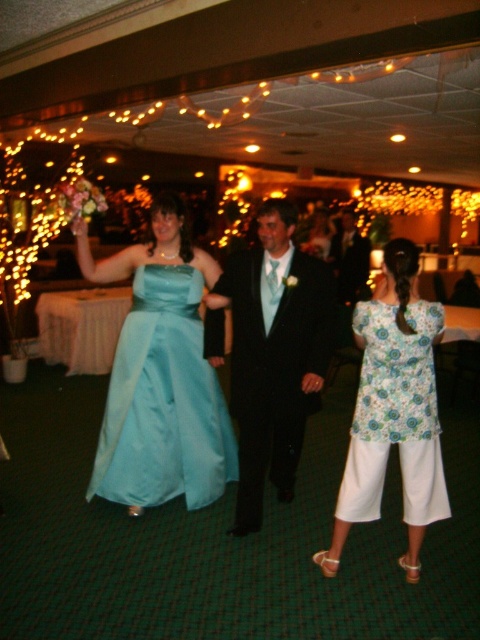
Question: From the image, what is the correct spatial relationship of matte blue dress at center in relation to shiny black suit at center?

Choices:
 (A) right
 (B) left

Answer: (A)

Question: Which object is closer to the camera taking this photo?

Choices:
 (A) shiny black suit at center
 (B) matte blue dress at center
 (C) light blue satin dress at center

Answer: (B)

Question: Does matte blue dress at center have a smaller size compared to shiny black suit at center?

Choices:
 (A) no
 (B) yes

Answer: (A)

Question: Is shiny black suit at center further to the viewer compared to light blue satin dress at center?

Choices:
 (A) yes
 (B) no

Answer: (B)

Question: Which object is positioned farthest from the floral fabric blouse at center?

Choices:
 (A) light blue satin dress at center
 (B) shiny black suit at center

Answer: (A)

Question: Which point is farther from the camera taking this photo?

Choices:
 (A) (172, 268)
 (B) (430, 396)
 (C) (421, 364)

Answer: (A)